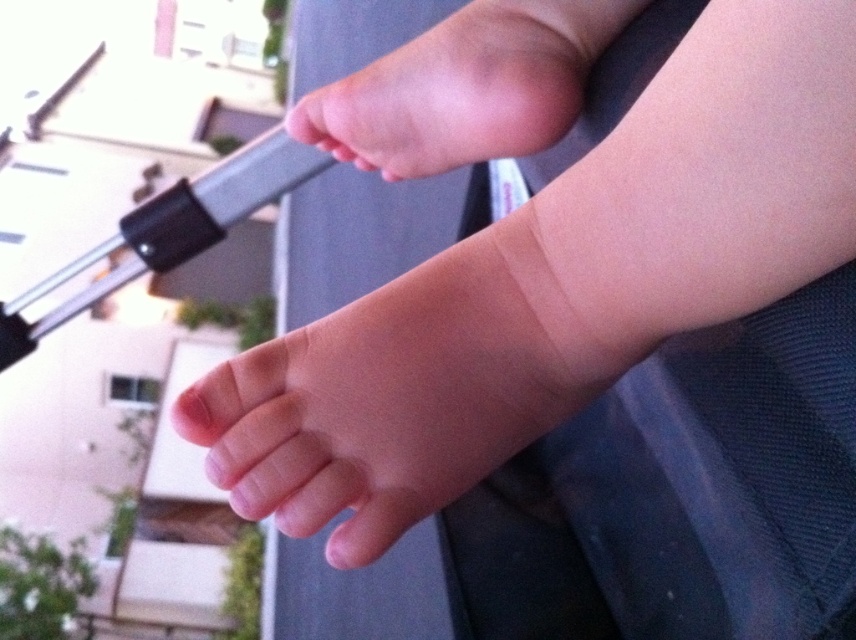
Which is in front, point (325, 362) or point (516, 58)?

Point (325, 362) is in front.

Who is higher up, pink smooth foot at center or pink smooth foot at upper center?

Positioned higher is pink smooth foot at upper center.

Who is more forward, (319, 346) or (503, 65)?

Point (319, 346) is more forward.

Find the location of a particular element. This screenshot has height=640, width=856. pink smooth foot at center is located at coordinates (395, 396).